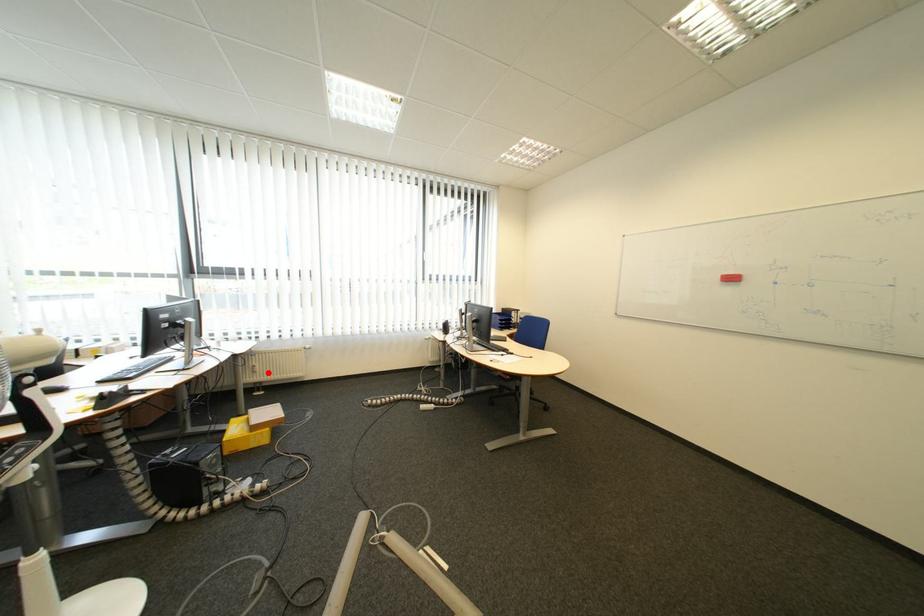
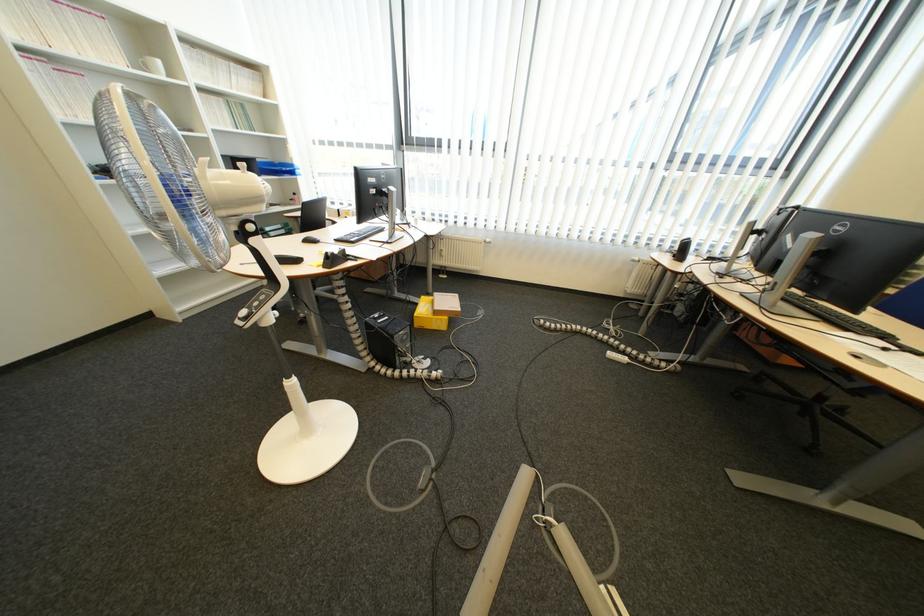
The point at the highlighted location is marked in the first image. Where is the corresponding point in the second image?

(455, 257)